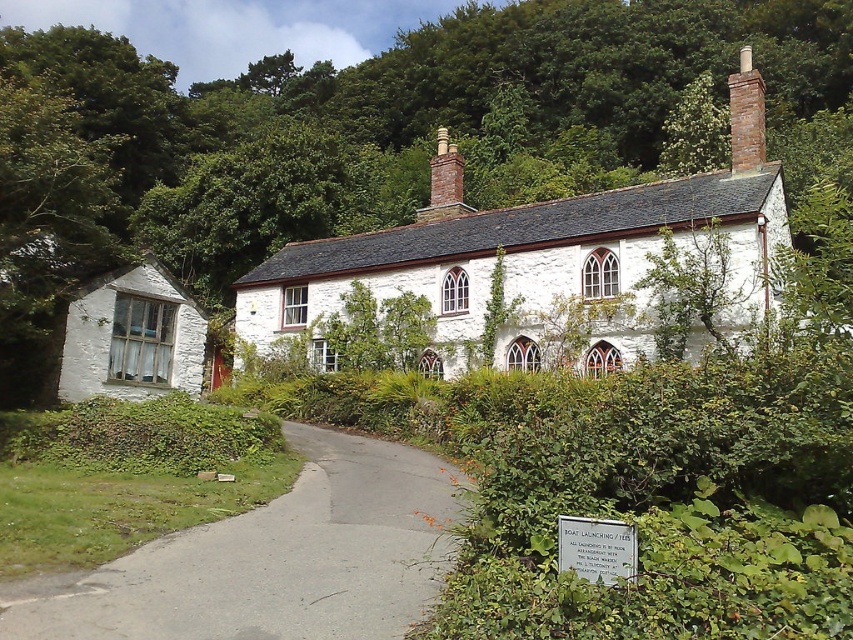
Question: Which object is closer to the camera taking this photo?

Choices:
 (A) brown brick chimney at upper right
 (B) gray asphalt driveway at lower center
 (C) white stone cottage at center

Answer: (B)

Question: Is gray asphalt driveway at lower center below white matte cottage at left?

Choices:
 (A) yes
 (B) no

Answer: (A)

Question: Does white stone cottage at center have a smaller size compared to white matte cottage at left?

Choices:
 (A) yes
 (B) no

Answer: (B)

Question: Which point is farther to the camera?

Choices:
 (A) white stone cottage at center
 (B) brown brick chimney at upper right

Answer: (B)

Question: Does white stone cottage at center have a greater width compared to white matte cottage at left?

Choices:
 (A) yes
 (B) no

Answer: (A)

Question: Estimate the real-world distances between objects in this image. Which object is farther from the white stone cottage at center?

Choices:
 (A) gray asphalt driveway at lower center
 (B) white matte cottage at left

Answer: (A)